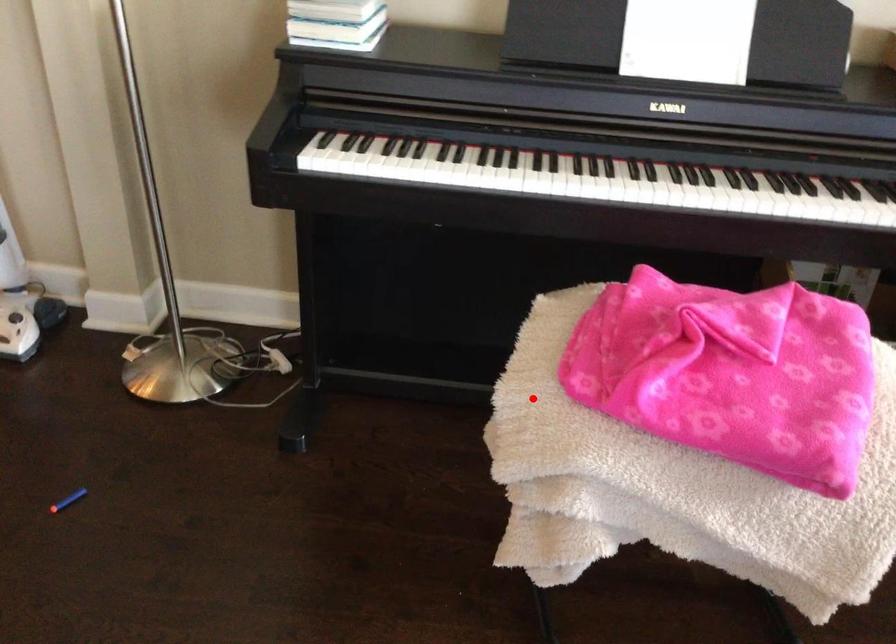
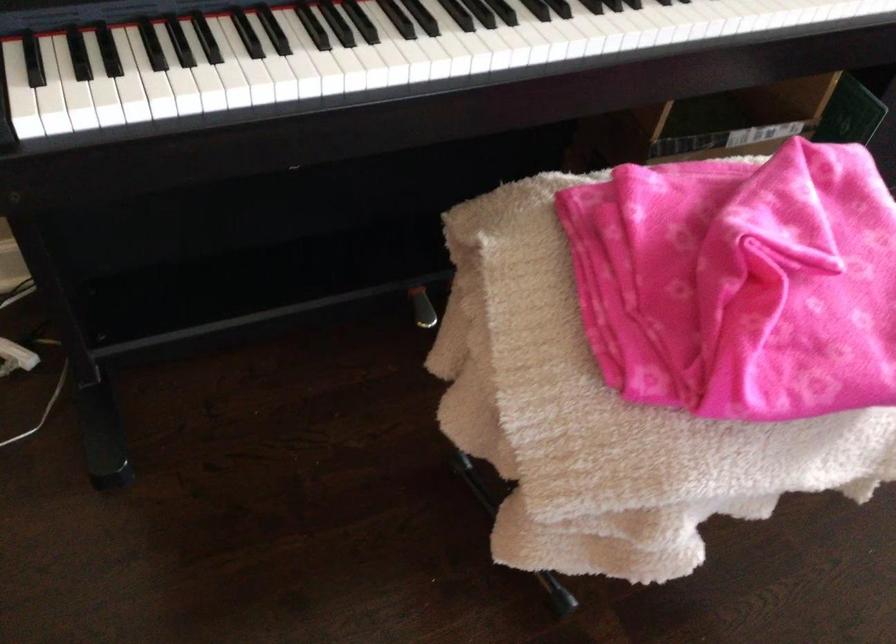
In the second image, find the point that corresponds to the highlighted location in the first image.

(571, 406)